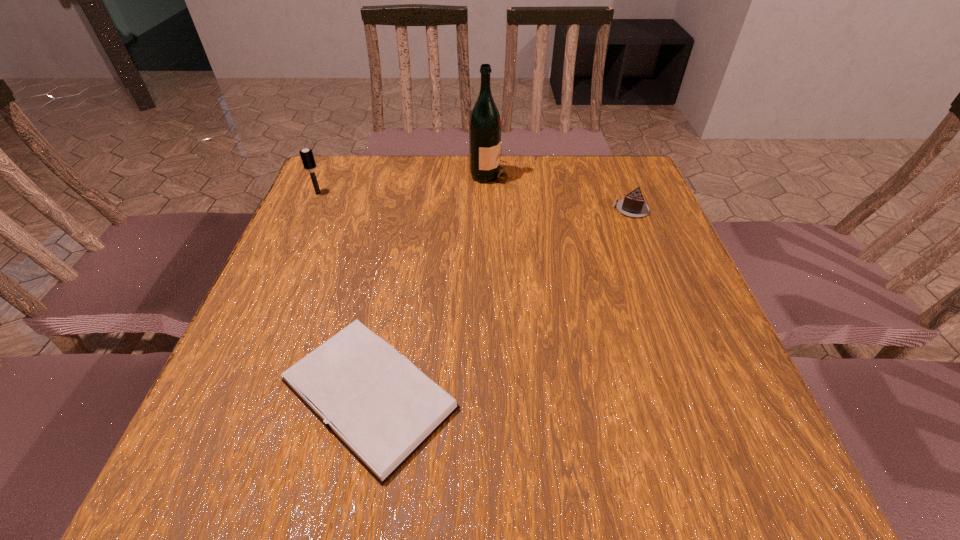
This screenshot has height=540, width=960. I want to click on object at the near left corner, so click(x=376, y=402).

Where is `object present at the far right corner`? object present at the far right corner is located at coordinates (632, 205).

The width and height of the screenshot is (960, 540). I want to click on blank space at the far edge, so click(518, 198).

In the image, there is a desktop. At what (x,y) coordinates should I click in order to perform the action: click on free space at the near edge. Please return your answer as a coordinate pair (x, y). Image resolution: width=960 pixels, height=540 pixels. Looking at the image, I should click on (545, 477).

I want to click on vacant space at the left edge of the desktop, so point(236,341).

At what (x,y) coordinates should I click in order to perform the action: click on free space at the right edge. Please return your answer as a coordinate pair (x, y). The width and height of the screenshot is (960, 540). Looking at the image, I should click on (653, 399).

Locate an element on the screen. Image resolution: width=960 pixels, height=540 pixels. free space at the near left corner of the desktop is located at coordinates (256, 472).

This screenshot has height=540, width=960. Identify the location of vacant area at the far right corner. (604, 201).

At what (x,y) coordinates should I click in order to perform the action: click on vacant space that's between the hairbrush and the second object from right to left. Please return your answer as a coordinate pair (x, y). Looking at the image, I should click on (403, 184).

The width and height of the screenshot is (960, 540). Identify the location of free spot between the nearest object and the wine bottle. (429, 284).